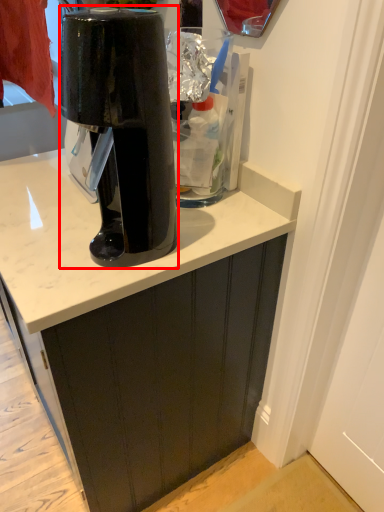
Question: Considering the relative positions of home appliance (annotated by the red box) and cabinetry in the image provided, where is home appliance (annotated by the red box) located with respect to the staircase?

Choices:
 (A) left
 (B) right

Answer: (B)